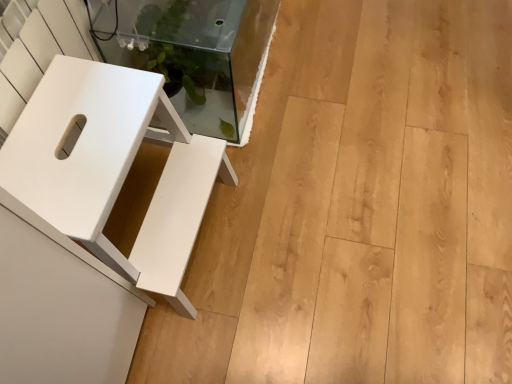
Question: Considering the relative sizes of transparent glass table at upper left and white matte stool at left in the image provided, is transparent glass table at upper left thinner than white matte stool at left?

Choices:
 (A) no
 (B) yes

Answer: (B)

Question: Is transparent glass table at upper left looking in the opposite direction of white matte stool at left?

Choices:
 (A) no
 (B) yes

Answer: (A)

Question: From the image's perspective, does transparent glass table at upper left appear higher than white matte stool at left?

Choices:
 (A) yes
 (B) no

Answer: (A)

Question: From a real-world perspective, is transparent glass table at upper left on white matte stool at left?

Choices:
 (A) yes
 (B) no

Answer: (B)

Question: From the image's perspective, is transparent glass table at upper left located beneath white matte stool at left?

Choices:
 (A) no
 (B) yes

Answer: (A)

Question: Does transparent glass table at upper left appear on the right side of white matte stool at left?

Choices:
 (A) no
 (B) yes

Answer: (B)

Question: Does white matte stool at left have a larger size compared to transparent glass table at upper left?

Choices:
 (A) no
 (B) yes

Answer: (A)

Question: Considering the relative positions of white matte stool at left and transparent glass table at upper left in the image provided, is white matte stool at left behind transparent glass table at upper left?

Choices:
 (A) no
 (B) yes

Answer: (A)

Question: Is white matte stool at left taller than transparent glass table at upper left?

Choices:
 (A) yes
 (B) no

Answer: (A)

Question: Is white matte stool at left smaller than transparent glass table at upper left?

Choices:
 (A) yes
 (B) no

Answer: (A)

Question: From a real-world perspective, is white matte stool at left below transparent glass table at upper left?

Choices:
 (A) no
 (B) yes

Answer: (A)

Question: Is white matte stool at left turned away from transparent glass table at upper left?

Choices:
 (A) yes
 (B) no

Answer: (B)

Question: From the image's perspective, is white matte stool at left positioned above or below transparent glass table at upper left?

Choices:
 (A) above
 (B) below

Answer: (B)